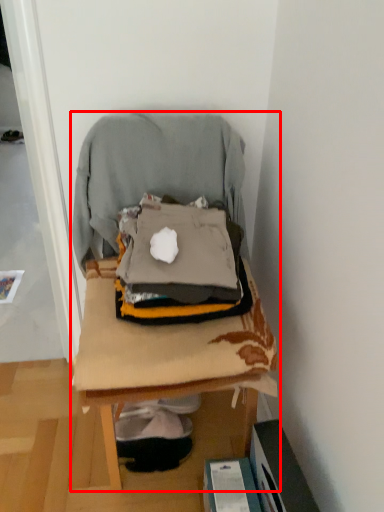
Question: From the image's perspective, considering the relative positions of furniture (annotated by the red box) and bean bag chair in the image provided, where is furniture (annotated by the red box) located with respect to the staircase?

Choices:
 (A) below
 (B) above

Answer: (A)